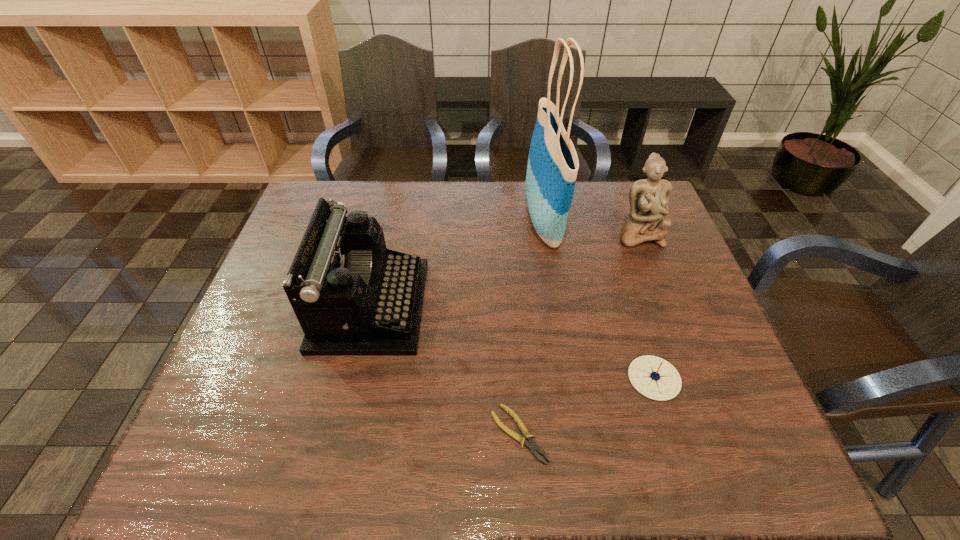
Locate an element on the screen. vacant space that is in between the pliers and the figurine is located at coordinates (579, 334).

Locate an element on the screen. This screenshot has height=540, width=960. free point between the figurine and the leftmost object is located at coordinates (505, 270).

Where is `vacant area between the fourth farthest object and the typewriter`? This screenshot has width=960, height=540. vacant area between the fourth farthest object and the typewriter is located at coordinates (513, 342).

Find the location of a particular element. This screenshot has height=540, width=960. vacant area that lies between the second nearest object and the third object from right to left is located at coordinates (599, 300).

Identify the location of free spot between the fourth tallest object and the figurine. The height and width of the screenshot is (540, 960). (647, 306).

Identify which object is the closest to the leftmost object. Please provide its 2D coordinates. Your answer should be formatted as a tuple, i.e. [(x, y)], where the tuple contains the x and y coordinates of a point satisfying the conditions above.

[(532, 445)]

Identify which object is the closest to the tallest object. Please provide its 2D coordinates. Your answer should be formatted as a tuple, i.e. [(x, y)], where the tuple contains the x and y coordinates of a point satisfying the conditions above.

[(649, 198)]

Identify the location of free spot that satisfies the following two spatial constraints: 1. on the front side of the fourth farthest object; 2. on the right side of the tallest object. The image size is (960, 540). (568, 378).

The height and width of the screenshot is (540, 960). In order to click on blank area in the image that satisfies the following two spatial constraints: 1. on the front-facing side of the figurine; 2. on the typing side of the leftmost object in this screenshot , I will do `click(666, 306)`.

Locate an element on the screen. blank space that satisfies the following two spatial constraints: 1. on the back side of the shortest object; 2. on the typing side of the typewriter is located at coordinates (511, 306).